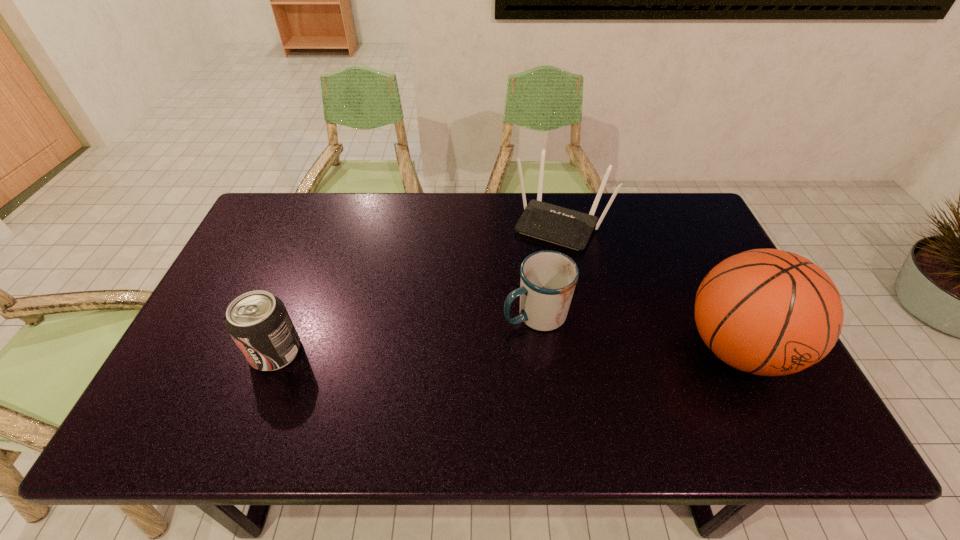
Locate an element on the screen. The height and width of the screenshot is (540, 960). free point between the router and the rightmost object is located at coordinates (649, 286).

You are a GUI agent. You are given a task and a screenshot of the screen. Output one action in this format:
    pyautogui.click(x=<x>, y=<y>)
    Task: Click on the blank region between the tallest object and the mug
    The image size is (960, 540).
    Given the screenshot: What is the action you would take?
    pyautogui.click(x=636, y=331)

Where is `unoccupied position between the rightmost object and the farthest object`? The height and width of the screenshot is (540, 960). unoccupied position between the rightmost object and the farthest object is located at coordinates point(649,286).

Where is `free spot between the rightmost object and the mug`? Image resolution: width=960 pixels, height=540 pixels. free spot between the rightmost object and the mug is located at coordinates (636, 331).

At what (x,y) coordinates should I click in order to perform the action: click on unoccupied area between the farthest object and the rightmost object. Please return your answer as a coordinate pair (x, y). This screenshot has width=960, height=540. Looking at the image, I should click on (649, 286).

At what (x,y) coordinates should I click in order to perform the action: click on free space between the router and the tallest object. Please return your answer as a coordinate pair (x, y). Looking at the image, I should click on (649, 286).

Where is `empty space between the leftmost object and the mug`? The width and height of the screenshot is (960, 540). empty space between the leftmost object and the mug is located at coordinates (406, 333).

Point out which object is positioned as the second nearest to the leftmost object. Please provide its 2D coordinates. Your answer should be formatted as a tuple, i.e. [(x, y)], where the tuple contains the x and y coordinates of a point satisfying the conditions above.

[(569, 228)]

Select which object is the third closest to the router. Please provide its 2D coordinates. Your answer should be formatted as a tuple, i.e. [(x, y)], where the tuple contains the x and y coordinates of a point satisfying the conditions above.

[(258, 322)]